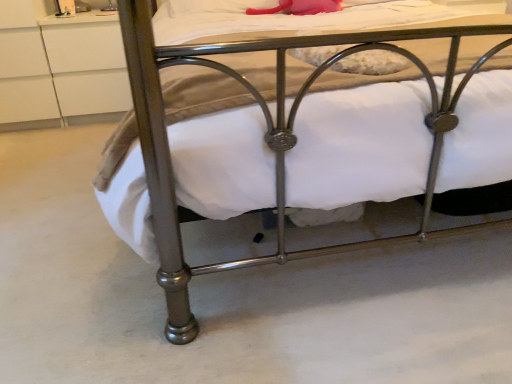
Question: Is point (69, 97) closer or farther from the camera than point (368, 241)?

Choices:
 (A) farther
 (B) closer

Answer: (A)

Question: Visually, is white matte drawer at upper left positioned to the left or to the right of metallic bed at lower center?

Choices:
 (A) left
 (B) right

Answer: (A)

Question: From a real-world perspective, is white matte drawer at upper left above or below metallic bed at lower center?

Choices:
 (A) below
 (B) above

Answer: (A)

Question: Looking at their shapes, would you say metallic bed at lower center is wider or thinner than white matte drawer at upper left?

Choices:
 (A) thin
 (B) wide

Answer: (B)

Question: Is metallic bed at lower center inside or outside of white matte drawer at upper left?

Choices:
 (A) outside
 (B) inside

Answer: (A)

Question: In terms of height, does metallic bed at lower center look taller or shorter compared to white matte drawer at upper left?

Choices:
 (A) short
 (B) tall

Answer: (B)

Question: In terms of size, does metallic bed at lower center appear bigger or smaller than white matte drawer at upper left?

Choices:
 (A) big
 (B) small

Answer: (A)